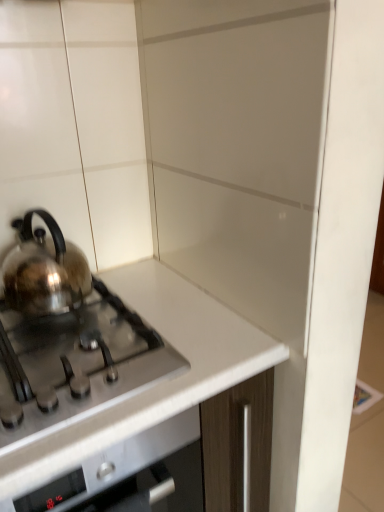
The image size is (384, 512). What do you see at coordinates (44, 271) in the screenshot?
I see `satin silver kettle at left` at bounding box center [44, 271].

The width and height of the screenshot is (384, 512). Describe the element at coordinates (157, 381) in the screenshot. I see `white glossy countertop at center` at that location.

The width and height of the screenshot is (384, 512). In order to click on satin silver kettle at left in this screenshot , I will do `click(44, 271)`.

Can you confirm if satin silver kettle at left is shorter than satin silver gas stove at left?

No, satin silver kettle at left is not shorter than satin silver gas stove at left.

Which object is wider, satin silver kettle at left or satin silver gas stove at left?

With larger width is satin silver gas stove at left.

Is satin silver kettle at left oriented away from satin silver gas stove at left?

satin silver kettle at left is not turned away from satin silver gas stove at left.

Which is behind, point (6, 269) or point (33, 389)?

Point (6, 269)

Which is behind, white glossy countertop at center or satin silver gas stove at left?

satin silver gas stove at left is further from the camera.

From a real-world perspective, who is located lower, white glossy countertop at center or satin silver gas stove at left?

From a 3D spatial view, white glossy countertop at center is below.

Can you confirm if white glossy countertop at center is positioned to the right of satin silver gas stove at left?

Yes.

Is point (204, 386) positioned after point (121, 375)?

Yes, it is.

Is satin silver gas stove at left taller or shorter than satin silver kettle at left?

satin silver gas stove at left is shorter than satin silver kettle at left.

Is satin silver gas stove at left located outside satin silver kettle at left?

Yes.

How far apart are satin silver gas stove at left and satin silver kettle at left?

satin silver gas stove at left is 5.58 inches from satin silver kettle at left.

From the image's perspective, is satin silver gas stove at left located above or below satin silver kettle at left?

satin silver gas stove at left is below satin silver kettle at left.

Looking at this image, from the image's perspective, is white glossy countertop at center located above satin silver kettle at left?

No, from the image's perspective, white glossy countertop at center is not above satin silver kettle at left.

From the picture: Considering the positions of objects white glossy countertop at center and satin silver kettle at left in the image provided, who is behind, white glossy countertop at center or satin silver kettle at left?

satin silver kettle at left is more distant.

Looking at their sizes, would you say white glossy countertop at center is wider or thinner than satin silver kettle at left?

Considering their sizes, white glossy countertop at center looks broader than satin silver kettle at left.

Between satin silver kettle at left and white glossy countertop at center, which one has smaller width?

satin silver kettle at left is thinner.

Considering the positions of objects satin silver kettle at left and white glossy countertop at center in the image provided, who is in front, satin silver kettle at left or white glossy countertop at center?

white glossy countertop at center is closer to the camera.

In order to click on countertop on the right of satin silver kettle at left in this screenshot , I will do click(x=157, y=381).

Can you tell me how much satin silver gas stove at left and white glossy countertop at center differ in facing direction?

There is a 0.531-degree angle between the facing directions of satin silver gas stove at left and white glossy countertop at center.

Consider the image. Is satin silver gas stove at left facing towards white glossy countertop at center?

No.

From the image's perspective, is satin silver gas stove at left under white glossy countertop at center?

No.

Considering the sizes of satin silver gas stove at left and white glossy countertop at center in the image, is satin silver gas stove at left wider or thinner than white glossy countertop at center?

Considering their sizes, satin silver gas stove at left looks slimmer than white glossy countertop at center.

Locate an element on the screen. gas stove in front of the satin silver kettle at left is located at coordinates (75, 362).

Image resolution: width=384 pixels, height=512 pixels. I want to click on countertop below the satin silver gas stove at left (from a real-world perspective), so click(x=157, y=381).

Considering their positions, is white glossy countertop at center positioned further to satin silver kettle at left than satin silver gas stove at left?

white glossy countertop at center is further to satin silver kettle at left.

Estimate the real-world distances between objects in this image. Which object is closer to satin silver gas stove at left, white glossy countertop at center or satin silver kettle at left?

The object closer to satin silver gas stove at left is white glossy countertop at center.

Estimate the real-world distances between objects in this image. Which object is closer to satin silver kettle at left, satin silver gas stove at left or white glossy countertop at center?

satin silver gas stove at left lies closer to satin silver kettle at left than the other object.

When comparing their distances from satin silver gas stove at left, does satin silver kettle at left or white glossy countertop at center seem further?

The object further to satin silver gas stove at left is satin silver kettle at left.

Based on their spatial positions, is satin silver gas stove at left or satin silver kettle at left closer to white glossy countertop at center?

satin silver gas stove at left.

Estimate the real-world distances between objects in this image. Which object is further from white glossy countertop at center, satin silver kettle at left or satin silver gas stove at left?

Based on the image, satin silver kettle at left appears to be further to white glossy countertop at center.

This screenshot has height=512, width=384. In order to click on gas stove between satin silver kettle at left and white glossy countertop at center from top to bottom in this screenshot , I will do `click(75, 362)`.